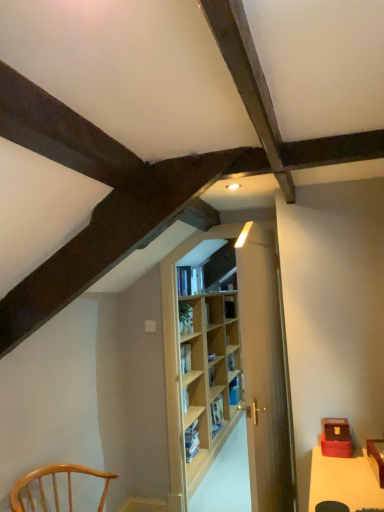
Question: Is wooden door at center behind blue hardcover book at center, placed as the second book when sorted from front to back?

Choices:
 (A) no
 (B) yes

Answer: (A)

Question: Does wooden door at center appear on the left side of blue hardcover book at center, which is the first book in right-to-left order?

Choices:
 (A) no
 (B) yes

Answer: (B)

Question: Is wooden door at center smaller than blue hardcover book at center, which is the 1th book in bottom-to-top order?

Choices:
 (A) no
 (B) yes

Answer: (A)

Question: From a real-world perspective, is wooden door at center on blue hardcover book at center, which is the first book in right-to-left order?

Choices:
 (A) yes
 (B) no

Answer: (A)

Question: Could you tell me if wooden door at center is turned towards blue hardcover book at center, positioned as the 2th book in top-to-bottom order?

Choices:
 (A) yes
 (B) no

Answer: (B)

Question: Is wooden door at center far away from blue hardcover book at center, positioned as the 2th book in top-to-bottom order?

Choices:
 (A) yes
 (B) no

Answer: (A)

Question: Is light brown wooden chair at lower left outside blue hardcover book at center, which ranks as the first book in back-to-front order?

Choices:
 (A) no
 (B) yes

Answer: (B)

Question: Does light brown wooden chair at lower left have a smaller size compared to blue hardcover book at center, positioned as the 2th book in top-to-bottom order?

Choices:
 (A) no
 (B) yes

Answer: (A)

Question: Can you confirm if light brown wooden chair at lower left is taller than blue hardcover book at center, placed as the second book when sorted from front to back?

Choices:
 (A) no
 (B) yes

Answer: (B)

Question: Can you confirm if light brown wooden chair at lower left is shorter than blue hardcover book at center, which is the first book in right-to-left order?

Choices:
 (A) no
 (B) yes

Answer: (A)

Question: Does light brown wooden chair at lower left lie behind blue hardcover book at center, placed as the second book when sorted from front to back?

Choices:
 (A) yes
 (B) no

Answer: (B)

Question: Would you consider light brown wooden chair at lower left to be distant from blue hardcover book at center, which is the 1th book in bottom-to-top order?

Choices:
 (A) no
 (B) yes

Answer: (B)

Question: From the image's perspective, is blue hardcover book at center, which ranks as the first book in back-to-front order, beneath hardcover book at center, which appears as the second book when viewed from the right?

Choices:
 (A) yes
 (B) no

Answer: (A)